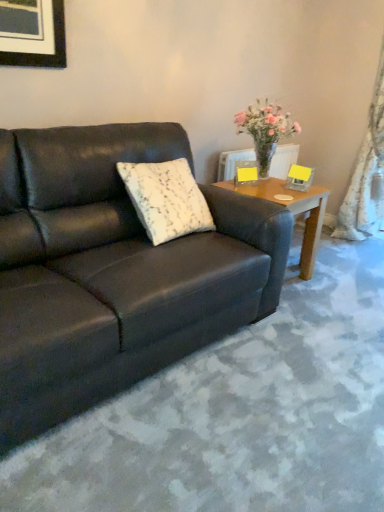
Question: From the image's perspective, is white textured pillow at center above or below wooden side table at right?

Choices:
 (A) above
 (B) below

Answer: (A)

Question: Considering the relative positions of white textured pillow at center and wooden side table at right in the image provided, is white textured pillow at center to the left or to the right of wooden side table at right?

Choices:
 (A) right
 (B) left

Answer: (B)

Question: Estimate the real-world distances between objects in this image. Which object is closer to the white lace curtain at right?

Choices:
 (A) white textured pillow at center
 (B) wooden side table at right
 (C) matte black couch at center
 (D) translucent glass vase at upper right

Answer: (B)

Question: Estimate the real-world distances between objects in this image. Which object is farther from the white textured pillow at center?

Choices:
 (A) translucent glass vase at upper right
 (B) wooden side table at right
 (C) white lace curtain at right
 (D) matte black couch at center

Answer: (C)